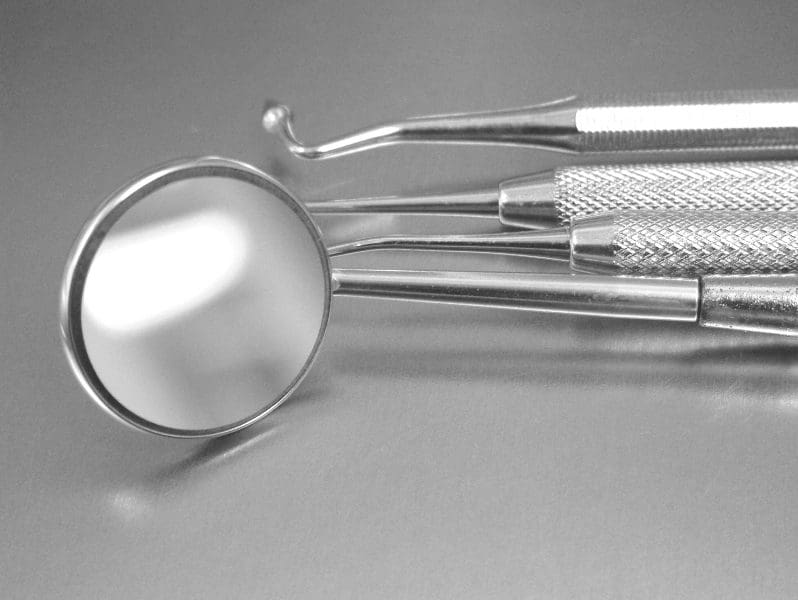
In order to click on mirrow in this screenshot , I will do `click(194, 296)`.